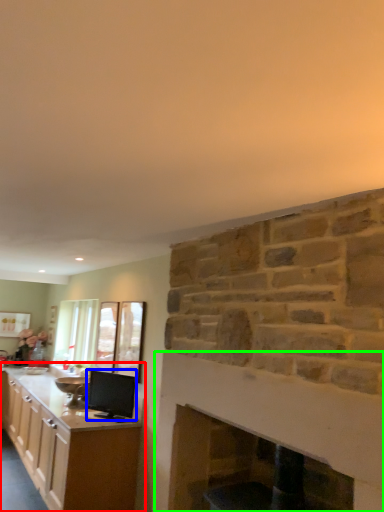
Question: Estimate the real-world distances between objects in this image. Which object is closer to cabinetry (highlighted by a red box), appliance (highlighted by a blue box) or fireplace (highlighted by a green box)?

Choices:
 (A) appliance
 (B) fireplace

Answer: (A)